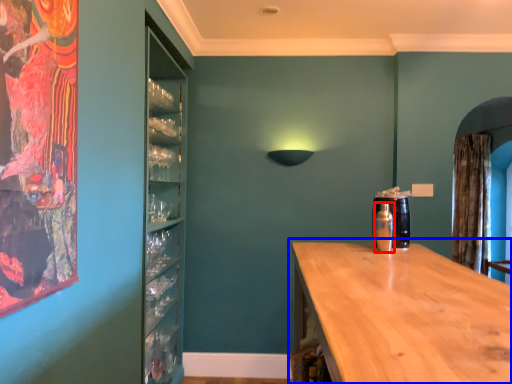
Question: Among these objects, which one is nearest to the camera, bottle (highlighted by a red box) or countertop (highlighted by a blue box)?

Choices:
 (A) bottle
 (B) countertop

Answer: (B)